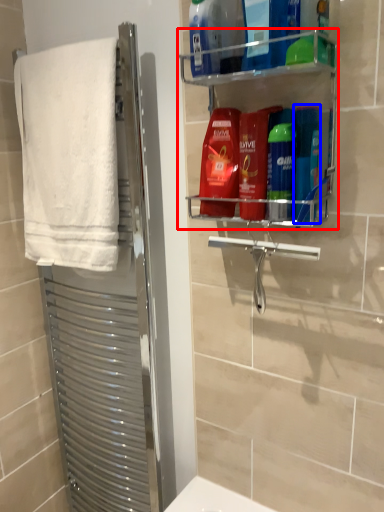
Question: Which object is closer to the camera taking this photo, shelf (highlighted by a red box) or toiletry (highlighted by a blue box)?

Choices:
 (A) shelf
 (B) toiletry

Answer: (A)